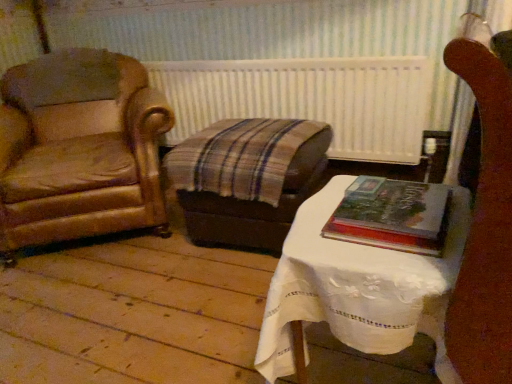
The image size is (512, 384). I want to click on free space above white lace-covered table at center (from a real-world perspective), so (x=343, y=228).